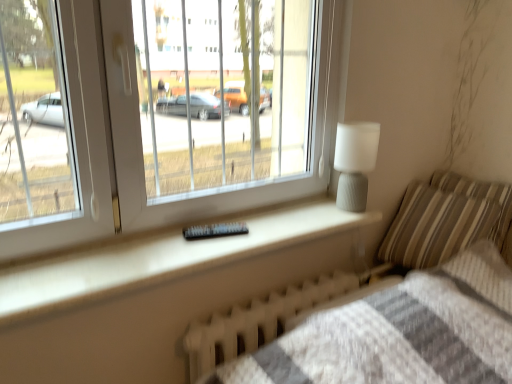
Question: Is white plastic window at upper left positioned behind white matte lamp at upper right?

Choices:
 (A) no
 (B) yes

Answer: (A)

Question: Does white plastic window at upper left have a greater height compared to white matte lamp at upper right?

Choices:
 (A) yes
 (B) no

Answer: (A)

Question: Is white plastic window at upper left positioned in front of white matte lamp at upper right?

Choices:
 (A) no
 (B) yes

Answer: (B)

Question: From a real-world perspective, is white plastic window at upper left positioned over white matte lamp at upper right based on gravity?

Choices:
 (A) no
 (B) yes

Answer: (B)

Question: Considering the relative positions of white plastic window at upper left and white matte lamp at upper right in the image provided, is white plastic window at upper left to the left of white matte lamp at upper right from the viewer's perspective?

Choices:
 (A) yes
 (B) no

Answer: (A)

Question: Does white plastic window at upper left have a lesser height compared to white matte lamp at upper right?

Choices:
 (A) no
 (B) yes

Answer: (A)

Question: Is white plastic window at upper left not near white textured radiator at lower center?

Choices:
 (A) no
 (B) yes

Answer: (B)

Question: Is white textured radiator at lower center located within white plastic window at upper left?

Choices:
 (A) no
 (B) yes

Answer: (A)

Question: Is white plastic window at upper left taller than white textured radiator at lower center?

Choices:
 (A) yes
 (B) no

Answer: (A)

Question: Considering the relative positions of white plastic window at upper left and white textured radiator at lower center in the image provided, is white plastic window at upper left to the right of white textured radiator at lower center from the viewer's perspective?

Choices:
 (A) yes
 (B) no

Answer: (B)

Question: Is white plastic window at upper left at the left side of white textured radiator at lower center?

Choices:
 (A) yes
 (B) no

Answer: (A)

Question: From the image's perspective, is white plastic window at upper left above white textured radiator at lower center?

Choices:
 (A) no
 (B) yes

Answer: (B)

Question: Is striped fabric pillow at right, arranged as the first pillow when viewed from the left, shorter than white matte lamp at upper right?

Choices:
 (A) no
 (B) yes

Answer: (A)